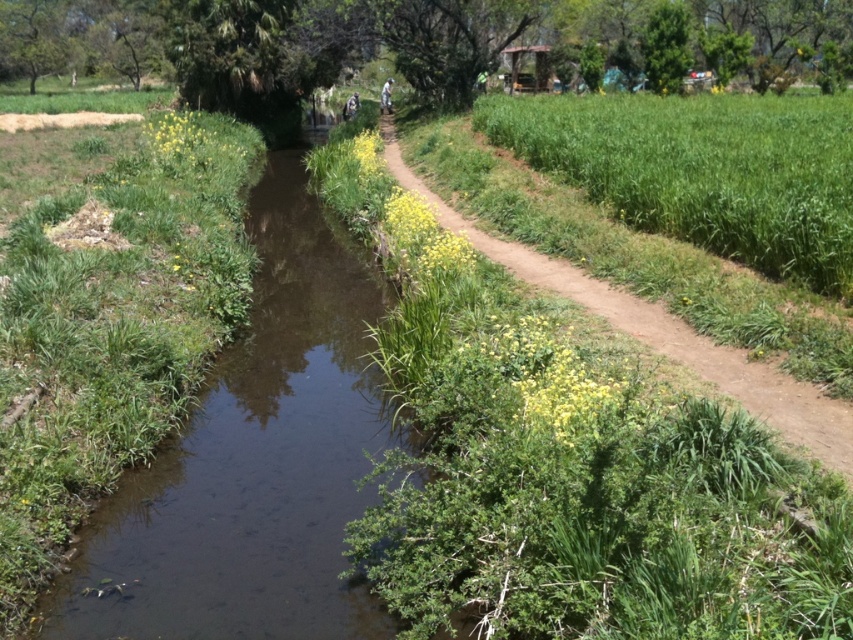
Question: Which point is farther to the camera?

Choices:
 (A) (613, 291)
 (B) (780, 129)

Answer: (B)

Question: Which point is closer to the camera taking this photo?

Choices:
 (A) (215, 516)
 (B) (799, 179)
 (C) (659, 314)

Answer: (A)

Question: Can you confirm if green grass at right is thinner than dirt path at center?

Choices:
 (A) yes
 (B) no

Answer: (B)

Question: Is green grass at right behind dirt path at center?

Choices:
 (A) yes
 (B) no

Answer: (A)

Question: Which of the following is the closest to the observer?

Choices:
 (A) green grass at right
 (B) brown muddy stream at center
 (C) dirt path at center

Answer: (C)

Question: Can you confirm if green grass at right is smaller than dirt path at center?

Choices:
 (A) no
 (B) yes

Answer: (A)